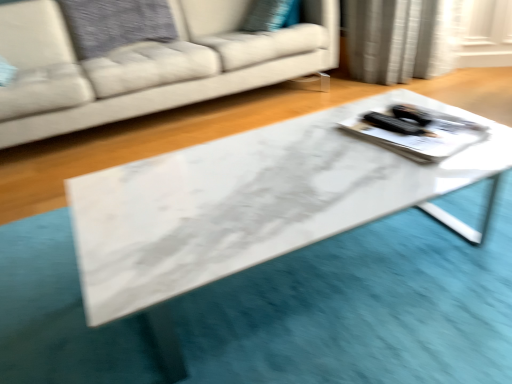
Question: From a real-world perspective, is white fabric couch at center physically below white glossy tray at center?

Choices:
 (A) no
 (B) yes

Answer: (A)

Question: Is the surface of white fabric couch at center in direct contact with white glossy tray at center?

Choices:
 (A) yes
 (B) no

Answer: (B)

Question: Is white fabric couch at center behind white glossy tray at center?

Choices:
 (A) yes
 (B) no

Answer: (A)

Question: Does white fabric couch at center turn towards white glossy tray at center?

Choices:
 (A) yes
 (B) no

Answer: (A)

Question: Does white fabric couch at center have a greater width compared to white glossy tray at center?

Choices:
 (A) yes
 (B) no

Answer: (A)

Question: Is white fabric couch at center positioned with its back to white glossy tray at center?

Choices:
 (A) no
 (B) yes

Answer: (A)

Question: Is white marble table at center behind white fabric couch at center?

Choices:
 (A) yes
 (B) no

Answer: (B)

Question: Is white marble table at center at the right side of white fabric couch at center?

Choices:
 (A) no
 (B) yes

Answer: (B)

Question: Is white marble table at center completely or partially outside of white fabric couch at center?

Choices:
 (A) yes
 (B) no

Answer: (A)

Question: Does white marble table at center have a larger size compared to white fabric couch at center?

Choices:
 (A) no
 (B) yes

Answer: (A)

Question: Can white fabric couch at center be found inside white marble table at center?

Choices:
 (A) no
 (B) yes

Answer: (A)

Question: Could you tell me if white marble table at center is turned towards white fabric couch at center?

Choices:
 (A) yes
 (B) no

Answer: (B)

Question: Is white glossy tray at center thinner than white fabric couch at center?

Choices:
 (A) yes
 (B) no

Answer: (A)